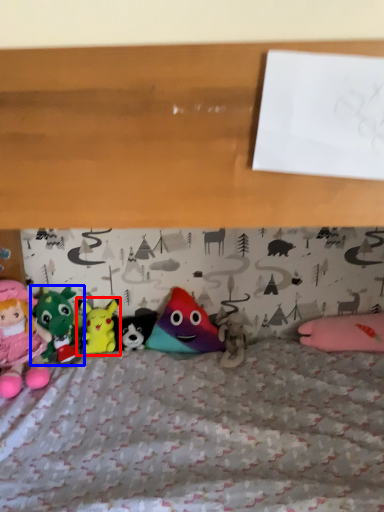
Question: Which object appears farthest to the camera in this image, toy (highlighted by a red box) or toy (highlighted by a blue box)?

Choices:
 (A) toy
 (B) toy

Answer: (A)